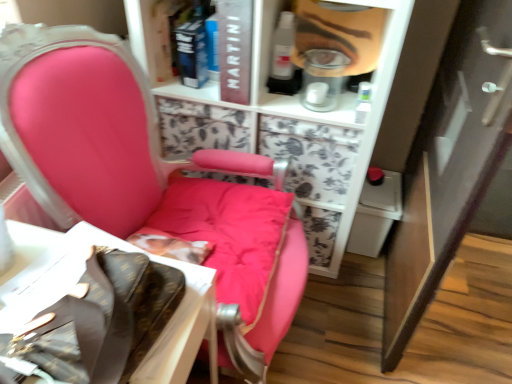
Question: Is matte white cabinet at right wider or thinner than hardcover book at upper center, the 2th book viewed from the right?

Choices:
 (A) thin
 (B) wide

Answer: (B)

Question: From the image's perspective, is matte white cabinet at right positioned above or below hardcover book at upper center, the 2th book viewed from the right?

Choices:
 (A) above
 (B) below

Answer: (B)

Question: Estimate the real-world distances between objects in this image. Which object is closer to the matte plastic face at upper center?

Choices:
 (A) matte black book at upper center, which is the second book in left-to-right order
 (B) white cardboard box at lower left
 (C) hardcover book at upper center, the 2th book viewed from the right
 (D) matte white cabinet at right
 (E) matte pink chair at center

Answer: (A)

Question: Which of these objects is positioned closest to the matte black book at upper center, which is the second book in left-to-right order?

Choices:
 (A) matte white cabinet at right
 (B) matte plastic face at upper center
 (C) hardcover book at upper center, which is the first book from left to right
 (D) matte pink chair at center
 (E) white cardboard box at lower left

Answer: (C)